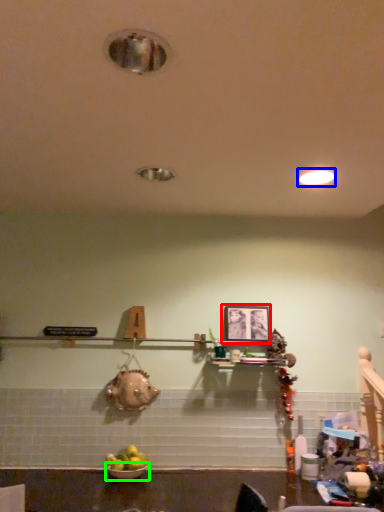
Question: Based on their relative distances, which object is farther from picture frame (highlighted by a red box)? Choose from lighting (highlighted by a blue box) and bowl (highlighted by a green box).

Choices:
 (A) lighting
 (B) bowl

Answer: (B)